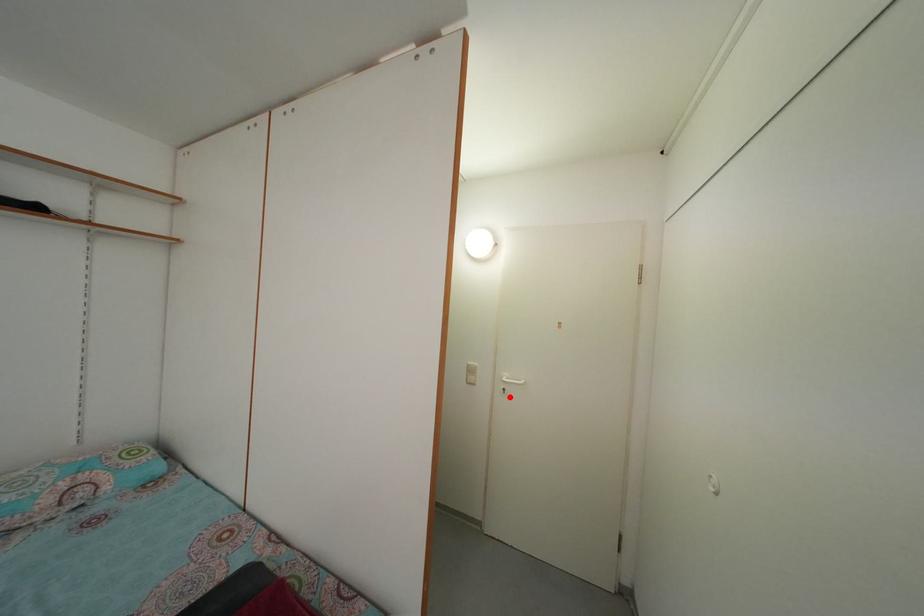
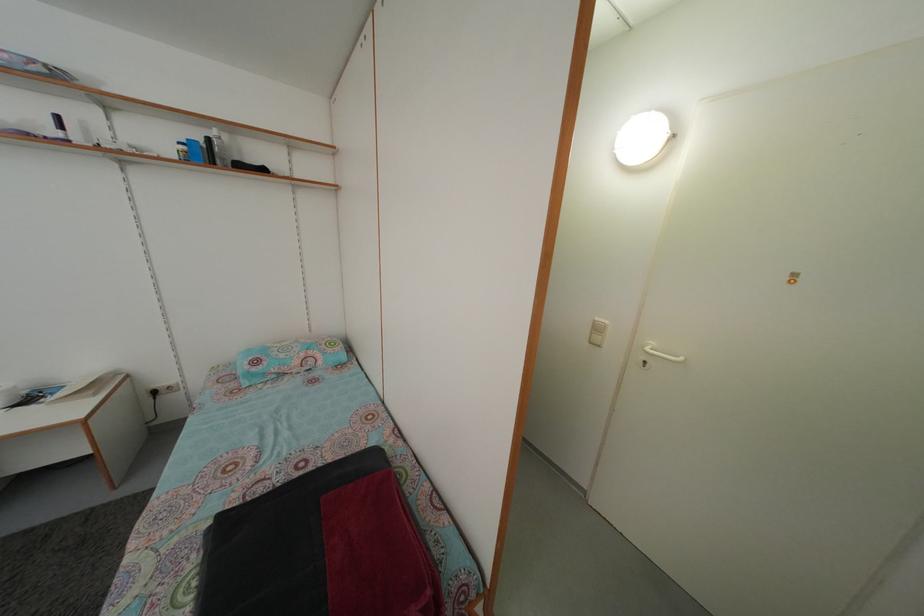
In the second image, find the point that corresponds to the highlighted location in the first image.

(650, 370)